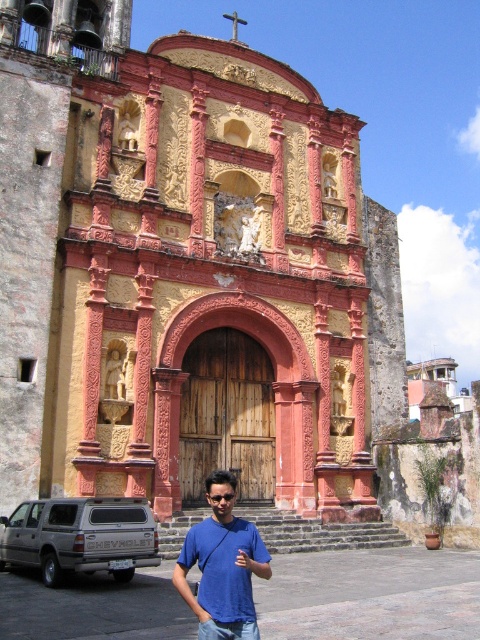
Which is behind, point (262, 150) or point (228, 637)?

The point (262, 150) is behind.

Locate an element on the screen. The height and width of the screenshot is (640, 480). yellowish-pink stone church at center is located at coordinates (186, 275).

You are a GUI agent. You are given a task and a screenshot of the screen. Output one action in this format:
    pyautogui.click(x=<x>, y=<y>)
    Task: Click on the yellowish-pink stone church at center
    
    Given the screenshot: What is the action you would take?
    pyautogui.click(x=186, y=275)